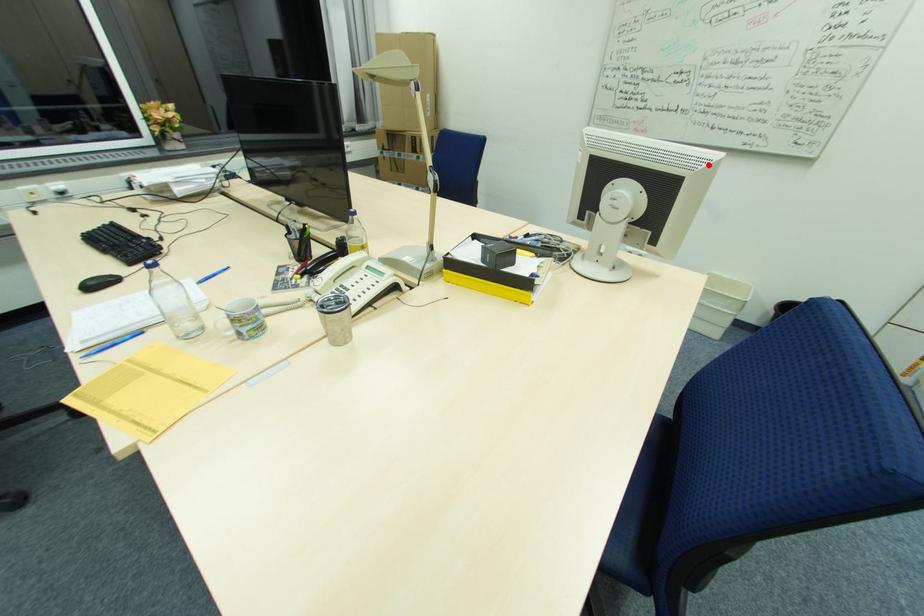
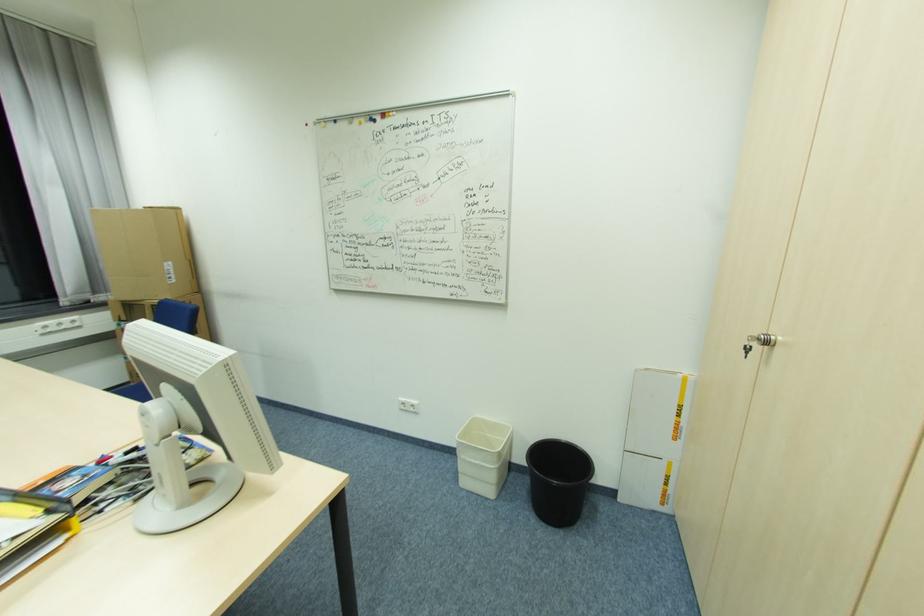
Where in the second image is the point corresponding to the highlighted location from the first image?

(207, 371)